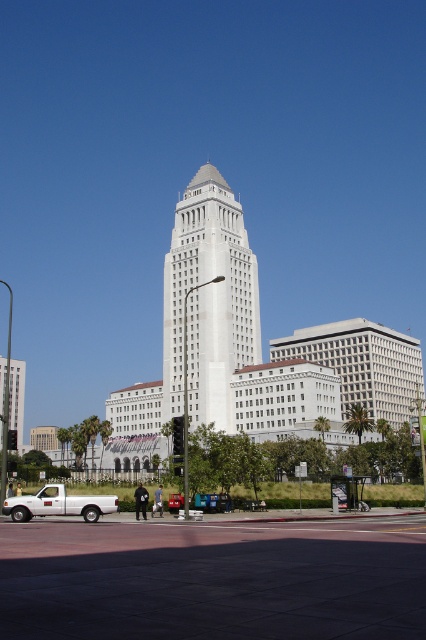
Who is lower down, white smooth tower at center or white matte truck at lower left?

white matte truck at lower left is lower down.

Between white smooth tower at center and white matte truck at lower left, which one appears on the left side from the viewer's perspective?

white matte truck at lower left

Does point (198, 269) come closer to viewer compared to point (26, 502)?

No, it is not.

At what (x,y) coordinates should I click in order to perform the action: click on white smooth tower at center. Please return your answer as a coordinate pair (x, y). Image resolution: width=426 pixels, height=640 pixels. Looking at the image, I should click on coord(209,301).